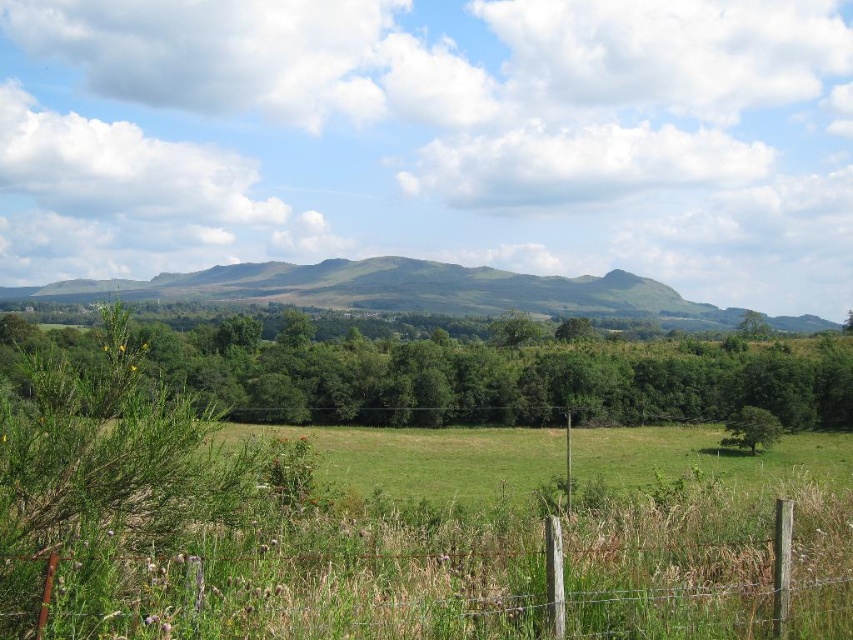
You are standing in the middle of the field and see the brown wooden fence at lower center and the green grassy hill at center. Which object is closer to you?

The brown wooden fence at lower center is closer to you because it is smaller in size compared to the green grassy hill at center, indicating it is nearer.

You are a farmer standing in the middle of the grassy field. You see the brown wooden fence at lower center and the green leafy tree at lower right. Which object is taller?

The green leafy tree at lower right is taller than the brown wooden fence at lower center.